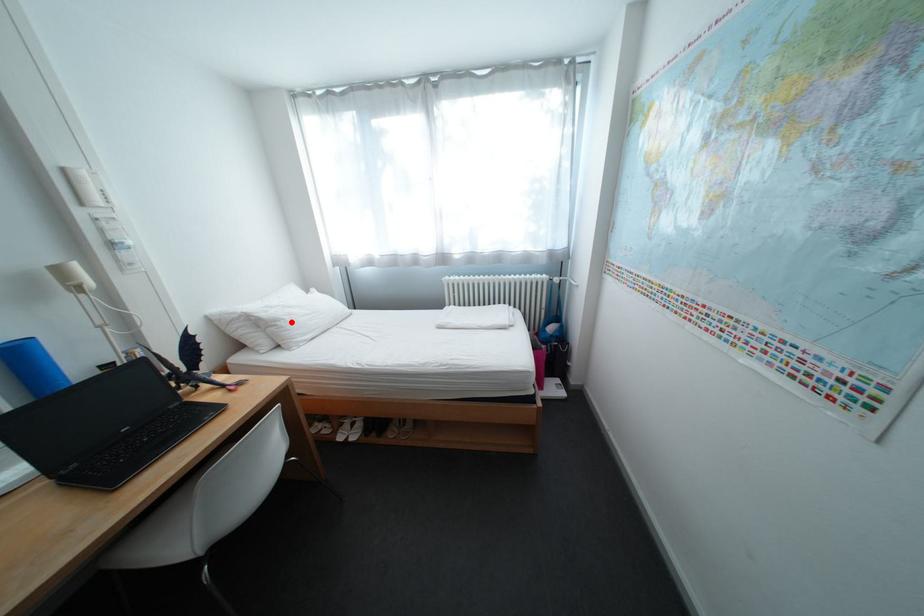
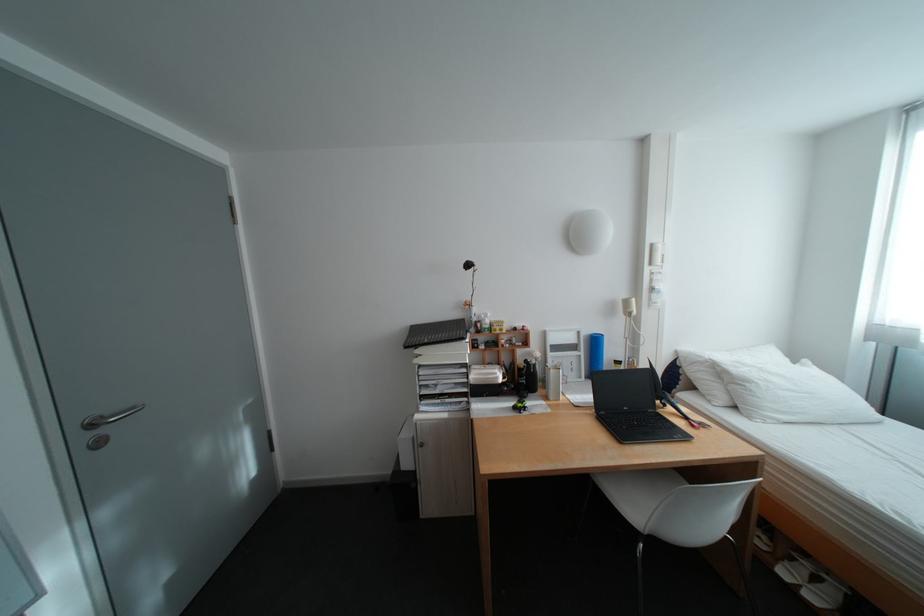
Question: I am providing you with two images of the same scene from different viewpoints. A red point is shown in image1. For the corresponding object point in image2, is it positioned nearer or farther from the camera?

Choices:
 (A) Nearer
 (B) Farther

Answer: (B)